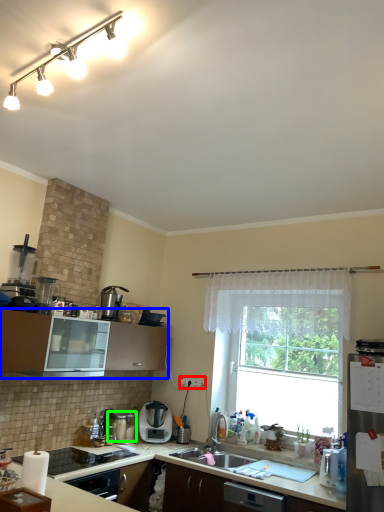
Question: Considering the real-world distances, which object is farthest from electric outlet (highlighted by a red box)? cabinetry (highlighted by a blue box) or appliance (highlighted by a green box)?

Choices:
 (A) cabinetry
 (B) appliance

Answer: (A)